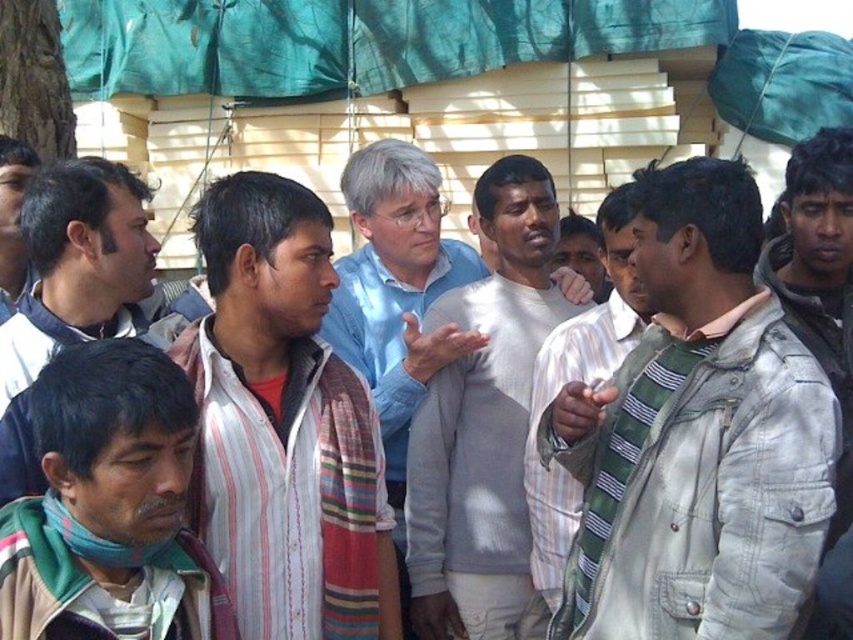
You are a photographer trying to capture a clear photo of the striped fabric shirt at left. However, the light gray denim jacket at center is blocking your view. Can you move around to the left side to get an unobstructed shot?

The light gray denim jacket at center is in front of the striped fabric shirt at left, so moving to the left side might allow you to see around the jacket and capture the shirt without obstruction.

You are a photographer trying to capture a group photo of the light gray sweater at center and the striped fabric shirt at left. Since you want both subjects to appear equally tall in the photo, which subject should you move closer to the camera?

The light gray sweater at center is much taller as striped fabric shirt at left. To make them appear equally tall in the photo, you should move the striped fabric shirt at left closer to the camera because it is shorter and needs to be magnified more to match the height of the light gray sweater at center.

You are a photographer standing at the back of the scene wanting to take a photo of both the light gray sweater at center and the striped fabric shirt at left without moving the subjects. Can you fit both subjects into the frame if your camera has a 1.5 meter field of view?

The distance between the light gray sweater at center and the striped fabric shirt at left is 3.76 meters. Since the camera has a 1.5 meter field of view, which is shorter than the distance between them, you cannot fit both subjects into the frame without moving the camera.